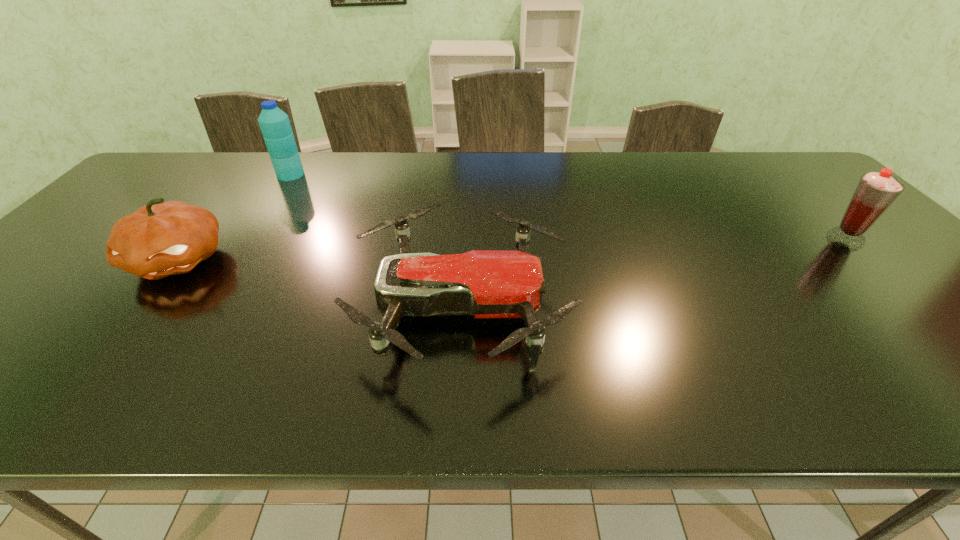
You are a GUI agent. You are given a task and a screenshot of the screen. Output one action in this format:
    pyautogui.click(x=<x>, y=<y>)
    Task: Click on the free space between the farthest object and the drone
    The image size is (960, 540).
    Given the screenshot: What is the action you would take?
    pyautogui.click(x=376, y=241)

Identify the location of free space that is in between the water bottle and the shortest object. (376, 241).

In order to click on free space that is in between the rightmost object and the third object from left to right in this screenshot , I will do `click(654, 273)`.

Where is `free space between the water bottle and the smoothie`? free space between the water bottle and the smoothie is located at coordinates 568,207.

What are the coordinates of `vacant space in between the farthest object and the drone` in the screenshot? It's located at (376, 241).

What are the coordinates of `vacant area that lies between the rightmost object and the drone` in the screenshot? It's located at (654, 273).

This screenshot has width=960, height=540. I want to click on free spot between the shortest object and the smoothie, so click(x=654, y=273).

This screenshot has width=960, height=540. Find the location of `object that can be found as the third closest to the second shortest object`. object that can be found as the third closest to the second shortest object is located at coordinates (875, 192).

The image size is (960, 540). I want to click on object that is the third nearest to the water bottle, so click(x=875, y=192).

Where is `free region that satisfies the following two spatial constraints: 1. on the front side of the smoothie; 2. on the front-facing side of the third object from left to right`? Image resolution: width=960 pixels, height=540 pixels. free region that satisfies the following two spatial constraints: 1. on the front side of the smoothie; 2. on the front-facing side of the third object from left to right is located at coordinates (915, 307).